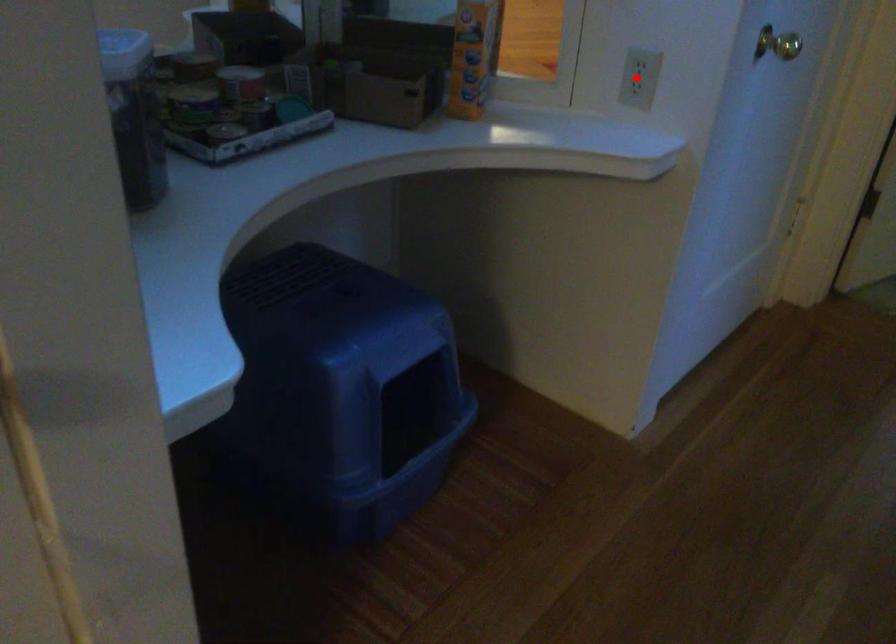
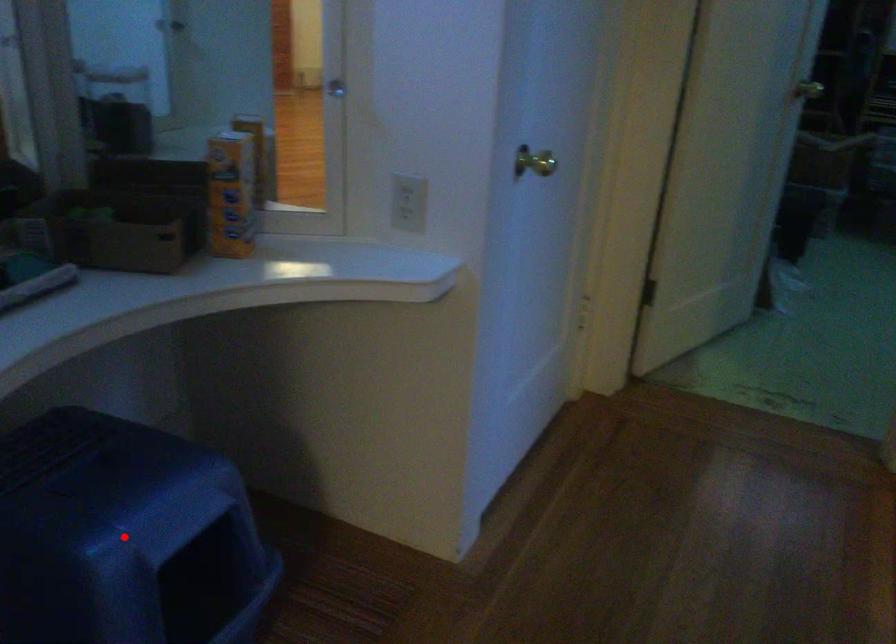
I am providing you with two images of the same scene from different viewpoints. A red point is marked on the first image and another point is marked on the second image. Do the highlighted points in image1 and image2 indicate the same real-world spot?

No